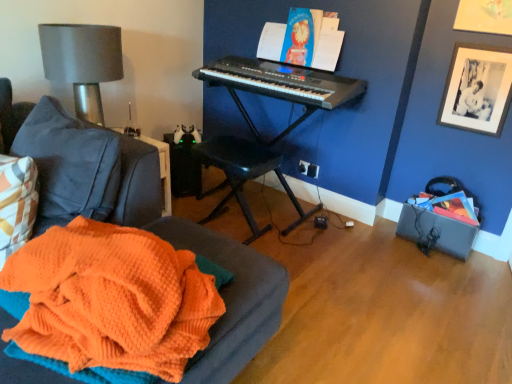
You are a GUI agent. You are given a task and a screenshot of the screen. Output one action in this format:
    pyautogui.click(x=<x>, y=<y>)
    Task: Click on the free location to the right of black plastic music stool at center
    The image size is (512, 384).
    Given the screenshot: What is the action you would take?
    pyautogui.click(x=294, y=249)